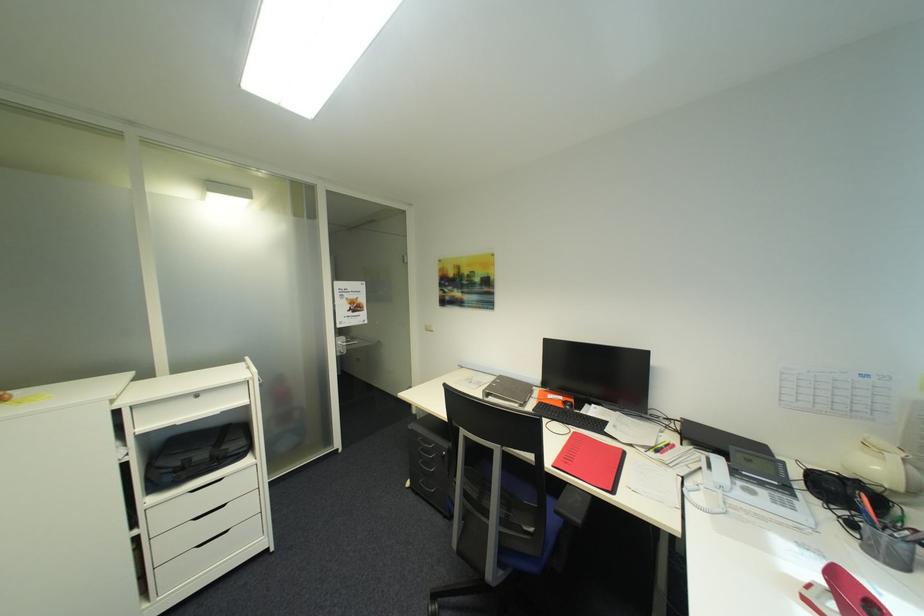
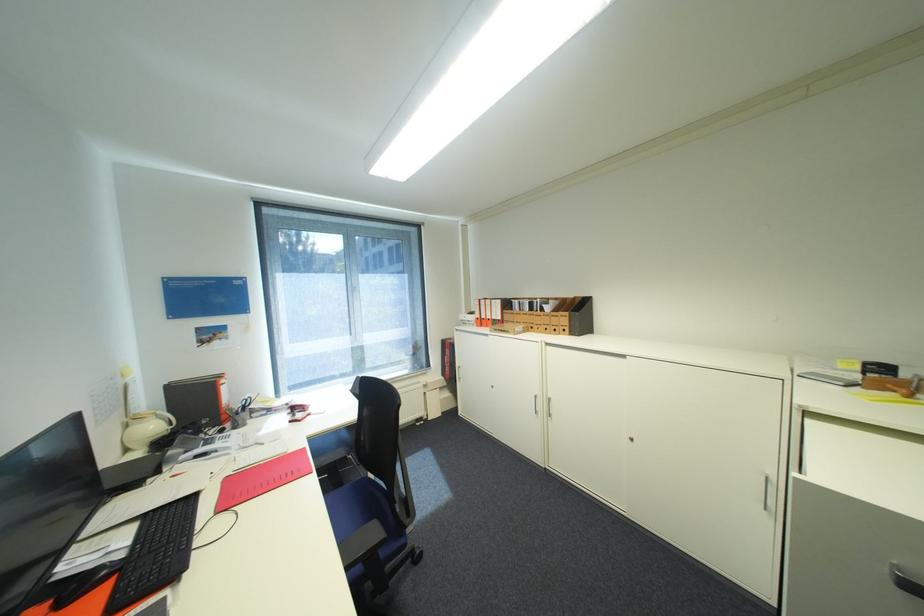
Locate, in the second image, the point that corresponds to (886,469) in the first image.

(161, 427)